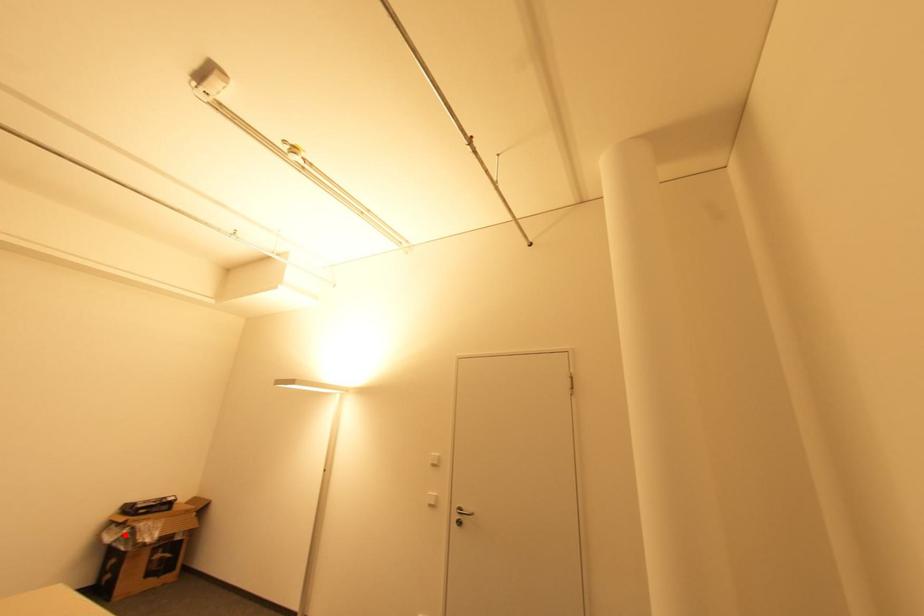
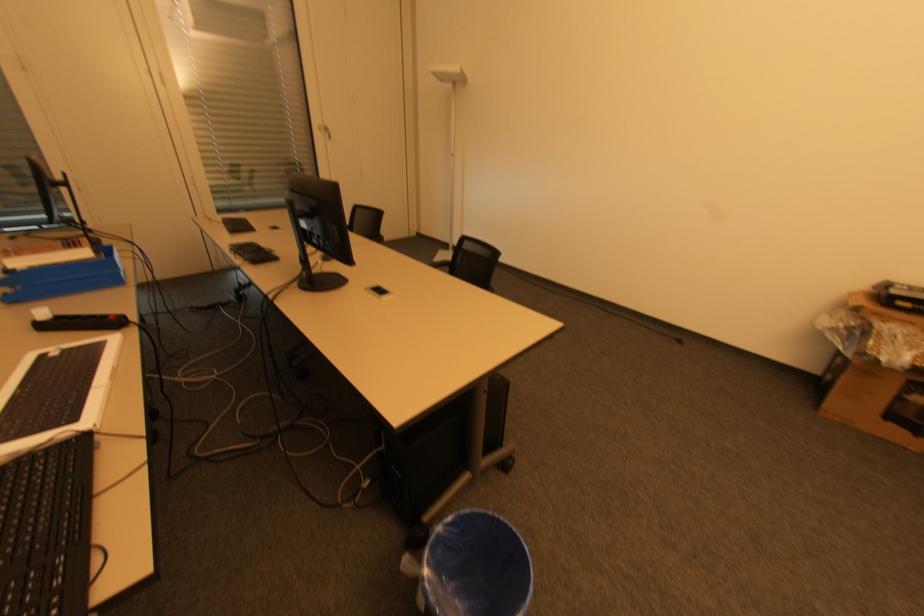
The point at the highlighted location is marked in the first image. Where is the corresponding point in the second image?

(850, 328)